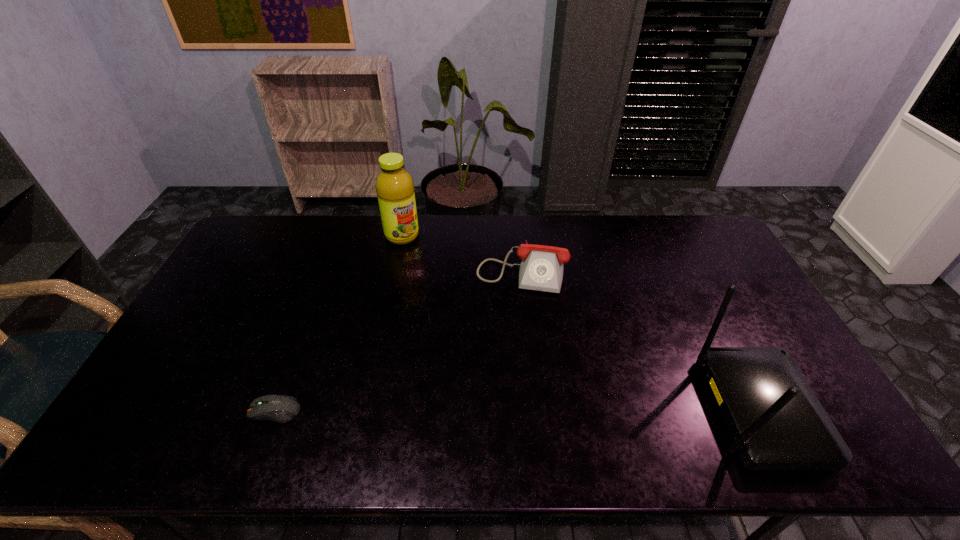
Find the location of a particular element. This screenshot has width=960, height=540. free area in between the shortest object and the telephone is located at coordinates (398, 339).

Where is `vacant area between the router and the third object from left to right`? The width and height of the screenshot is (960, 540). vacant area between the router and the third object from left to right is located at coordinates (639, 339).

This screenshot has width=960, height=540. Identify the location of free point between the router and the second object from right to left. (639, 339).

The height and width of the screenshot is (540, 960). I want to click on free point between the router and the fruit juice, so click(580, 323).

This screenshot has width=960, height=540. What are the coordinates of `free space between the router and the leftmost object` in the screenshot? It's located at (516, 411).

The height and width of the screenshot is (540, 960). I want to click on vacant area between the telephone and the router, so click(x=639, y=339).

This screenshot has height=540, width=960. What are the coordinates of `object that stands as the third closest to the second object from right to left` in the screenshot? It's located at (278, 408).

Identify the location of object that is the closest to the rightmost object. The height and width of the screenshot is (540, 960). (541, 269).

The width and height of the screenshot is (960, 540). I want to click on vacant space that satisfies the following two spatial constraints: 1. on the front side of the telephone; 2. on the right side of the fruit juice, so click(396, 268).

This screenshot has height=540, width=960. What are the coordinates of `free location that satisfies the following two spatial constraints: 1. on the front side of the second shortest object; 2. on the front-facing side of the rightmost object` in the screenshot? It's located at (537, 411).